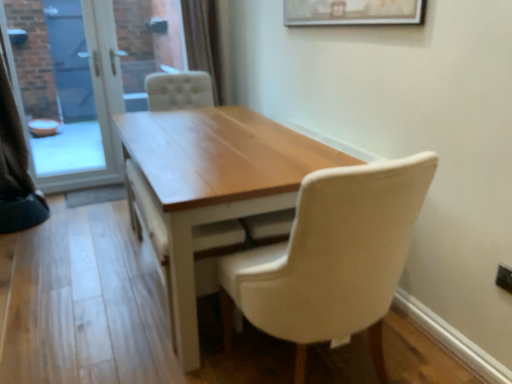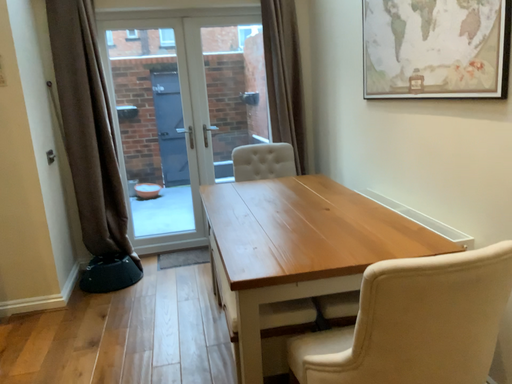
Question: Which way did the camera rotate in the video?

Choices:
 (A) rotated right
 (B) rotated left

Answer: (B)